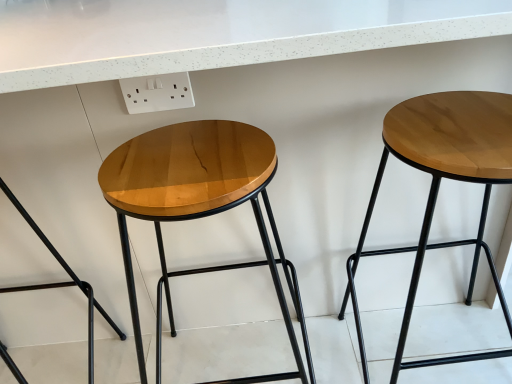
Question: Based on their positions, is white plastic outlet at upper center located to the left or right of wooden stool at center, which is the second stool from right to left?

Choices:
 (A) right
 (B) left

Answer: (B)

Question: From the image's perspective, is white plastic outlet at upper center positioned above or below wooden stool at center, which is the second stool from left to right?

Choices:
 (A) below
 (B) above

Answer: (B)

Question: Which of these objects is positioned farthest from the white plastic outlet at upper center?

Choices:
 (A) wooden stool at right, the third stool in the left-to-right sequence
 (B) wooden/marbled stool at left, which appears as the 1th stool when viewed from the left
 (C) wooden stool at center, which is the second stool from right to left

Answer: (A)

Question: Estimate the real-world distances between objects in this image. Which object is farther from the wooden/marbled stool at left, positioned as the 3th stool in right-to-left order?

Choices:
 (A) wooden stool at center, which is the second stool from right to left
 (B) white plastic outlet at upper center
 (C) wooden stool at right, the third stool in the left-to-right sequence

Answer: (C)